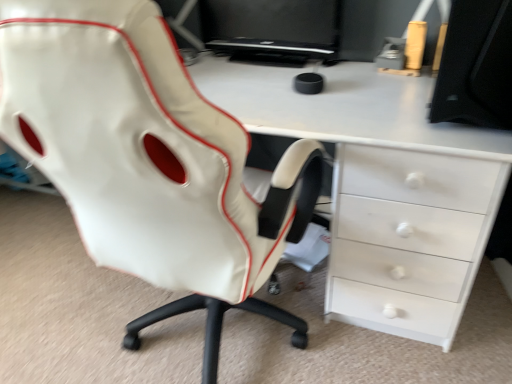
Identify the location of empty space that is in between black glossy monitor at upper center and black matte monitor at upper right. This screenshot has height=384, width=512. (345, 84).